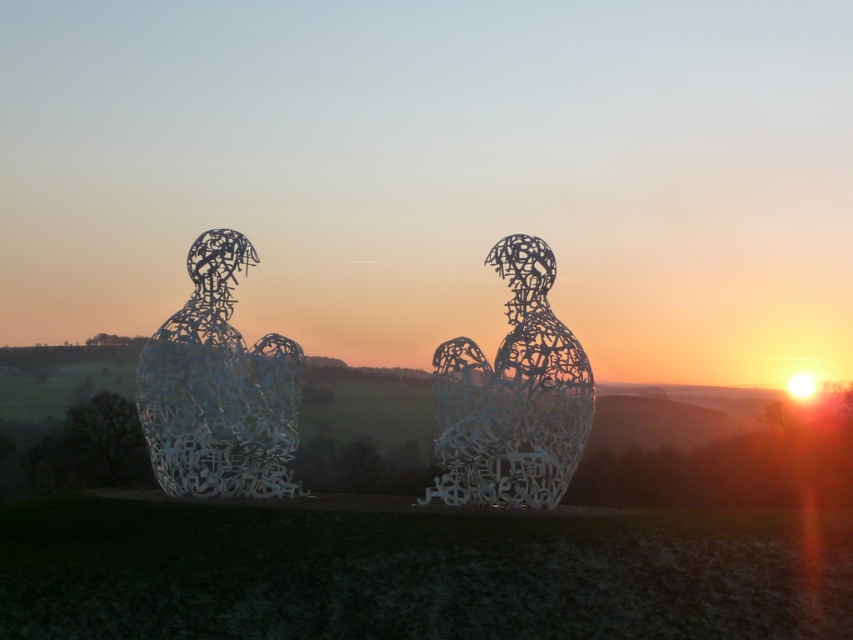
Question: Observing the image, what is the correct spatial positioning of white wire sculpture at left in reference to metallic wire sculpture at center?

Choices:
 (A) below
 (B) above

Answer: (B)

Question: Where is white wire sculpture at left located in relation to metallic wire sculpture at center in the image?

Choices:
 (A) below
 (B) above

Answer: (B)

Question: Which point is farther from the camera taking this photo?

Choices:
 (A) (292, 388)
 (B) (569, 445)

Answer: (A)

Question: Is white wire sculpture at left smaller than metallic wire sculpture at center?

Choices:
 (A) yes
 (B) no

Answer: (B)

Question: Among these points, which one is nearest to the camera?

Choices:
 (A) (160, 438)
 (B) (517, 284)

Answer: (A)